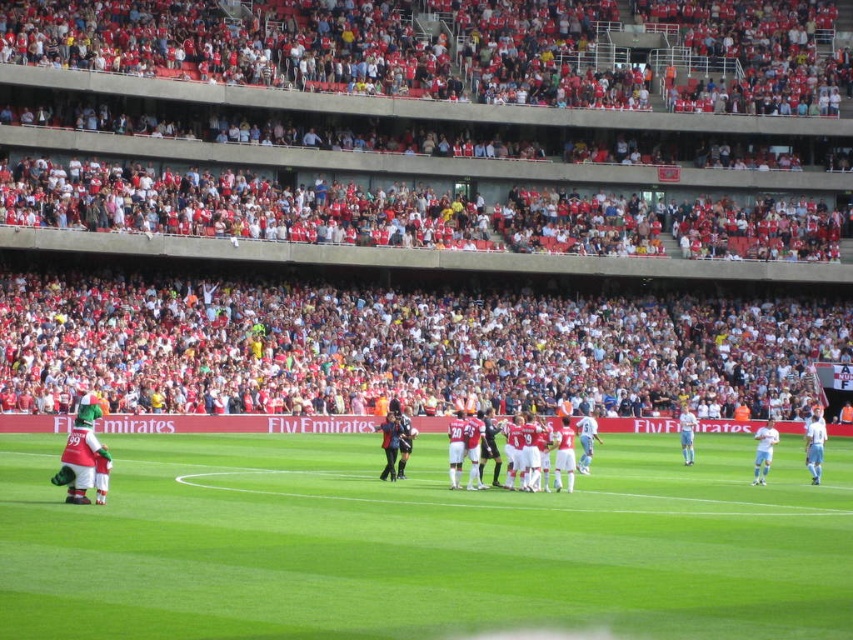
Question: Does red fabric crowd at upper center come behind green grass field at center?

Choices:
 (A) yes
 (B) no

Answer: (A)

Question: Which point is closer to the camera?

Choices:
 (A) red fabric crowd at upper center
 (B) green grass field at center

Answer: (B)

Question: Does red fabric crowd at upper center appear on the left side of green grass field at center?

Choices:
 (A) no
 (B) yes

Answer: (A)

Question: Is red fabric crowd at upper center bigger than green grass field at center?

Choices:
 (A) yes
 (B) no

Answer: (A)

Question: Which point is farther to the camera?

Choices:
 (A) (215, 512)
 (B) (204, 44)

Answer: (B)